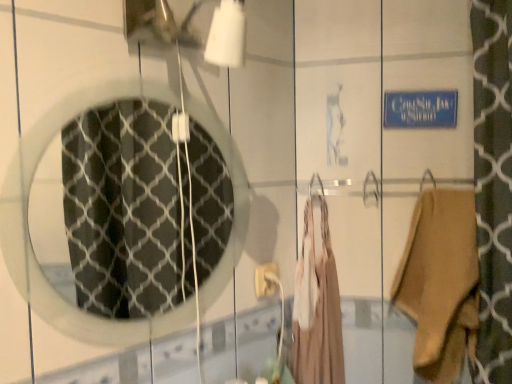
Locate an element on the screen. The height and width of the screenshot is (384, 512). tan suede boot at right, the 1th clothing viewed from the right is located at coordinates (440, 282).

From a real-world perspective, does beige fabric dress at center, which is the 2th clothing from right to left, sit lower than white plastic electric outlet at center?

Yes, from a real-world perspective, beige fabric dress at center, which is the 2th clothing from right to left, is below white plastic electric outlet at center.

Image resolution: width=512 pixels, height=384 pixels. I want to click on electric outlet behind the beige fabric dress at center, the 1th clothing when ordered from left to right, so click(x=265, y=280).

From the image's perspective, is beige fabric dress at center, which is the 2th clothing from right to left, over white plastic electric outlet at center?

Incorrect, from the image's perspective, beige fabric dress at center, which is the 2th clothing from right to left, is lower than white plastic electric outlet at center.

From a real-world perspective, who is located higher, clear glass mirror at center or tan suede boot at right, the 1th clothing viewed from the right?

clear glass mirror at center.

From the image's perspective, who appears lower, clear glass mirror at center or tan suede boot at right, the 1th clothing viewed from the right?

tan suede boot at right, the 1th clothing viewed from the right.

Are clear glass mirror at center and tan suede boot at right, the 1th clothing viewed from the right, located far from each other?

That's right, there is a large distance between clear glass mirror at center and tan suede boot at right, the 1th clothing viewed from the right.

Is point (166, 205) behind point (458, 359)?

Yes, point (166, 205) is farther from viewer.

Considering the relative sizes of white plastic electric outlet at center and clear glass mirror at center in the image provided, is white plastic electric outlet at center wider than clear glass mirror at center?

Correct, the width of white plastic electric outlet at center exceeds that of clear glass mirror at center.

Is white plastic electric outlet at center in contact with clear glass mirror at center?

No, white plastic electric outlet at center is not beside clear glass mirror at center.

Does white plastic electric outlet at center have a greater height compared to clear glass mirror at center?

No, white plastic electric outlet at center is not taller than clear glass mirror at center.

Where is `electric outlet on the right of clear glass mirror at center`? The width and height of the screenshot is (512, 384). electric outlet on the right of clear glass mirror at center is located at coordinates (265, 280).

In the scene shown: From a real-world perspective, is tan suede boot at right, the second clothing viewed from the left, positioned over white plastic electric outlet at center based on gravity?

Actually, tan suede boot at right, the second clothing viewed from the left, is physically below white plastic electric outlet at center in the real world.

Is tan suede boot at right, the 1th clothing viewed from the right, not near white plastic electric outlet at center?

No, tan suede boot at right, the 1th clothing viewed from the right, is in close proximity to white plastic electric outlet at center.

Which of these two, tan suede boot at right, the 1th clothing viewed from the right, or white plastic electric outlet at center, is wider?

tan suede boot at right, the 1th clothing viewed from the right.

Is tan suede boot at right, the 1th clothing viewed from the right, behind white plastic electric outlet at center?

No, it is in front of white plastic electric outlet at center.

Does clear glass mirror at center come in front of white plastic electric outlet at center?

Yes, it is.

Between clear glass mirror at center and white plastic electric outlet at center, which one appears on the right side from the viewer's perspective?

white plastic electric outlet at center is more to the right.

Is clear glass mirror at center situated inside white plastic electric outlet at center or outside?

clear glass mirror at center lies outside white plastic electric outlet at center.

Based on the photo, can you see clear glass mirror at center touching white plastic electric outlet at center?

No, clear glass mirror at center is not with white plastic electric outlet at center.

From the image's perspective, does beige fabric dress at center, which is the 2th clothing from right to left, appear higher than clear glass mirror at center?

Incorrect, from the image's perspective, beige fabric dress at center, which is the 2th clothing from right to left, is lower than clear glass mirror at center.

Is beige fabric dress at center, the 1th clothing when ordered from left to right, in front of or behind clear glass mirror at center in the image?

beige fabric dress at center, the 1th clothing when ordered from left to right, is behind clear glass mirror at center.

Is point (317, 285) positioned after point (217, 239)?

No, it is not.

Looking at their sizes, would you say beige fabric dress at center, which is the 2th clothing from right to left, is wider or thinner than clear glass mirror at center?

Clearly, beige fabric dress at center, which is the 2th clothing from right to left, has more width compared to clear glass mirror at center.

From a real-world perspective, between tan suede boot at right, the second clothing viewed from the left, and beige fabric dress at center, which is the 2th clothing from right to left, who is vertically higher?

In real-world perspective, tan suede boot at right, the second clothing viewed from the left, is above.

Is tan suede boot at right, the second clothing viewed from the left, inside or outside of beige fabric dress at center, the 1th clothing when ordered from left to right?

tan suede boot at right, the second clothing viewed from the left, is not enclosed by beige fabric dress at center, the 1th clothing when ordered from left to right.

In the image, there is a tan suede boot at right, the second clothing viewed from the left. Identify the location of clothing below it (from a real-world perspective). This screenshot has height=384, width=512. (319, 312).

Looking at this image, considering the relative sizes of tan suede boot at right, the second clothing viewed from the left, and beige fabric dress at center, the 1th clothing when ordered from left to right, in the image provided, is tan suede boot at right, the second clothing viewed from the left, shorter than beige fabric dress at center, the 1th clothing when ordered from left to right,?

Yes.

Where is `electric outlet above the beige fabric dress at center, which is the 2th clothing from right to left (from a real-world perspective)`? The width and height of the screenshot is (512, 384). electric outlet above the beige fabric dress at center, which is the 2th clothing from right to left (from a real-world perspective) is located at coordinates (265, 280).

In the image, there is a tan suede boot at right, the second clothing viewed from the left. Identify the location of mirror above it (from the image's perspective). (123, 209).

From the image, which object appears to be farther from clear glass mirror at center, tan suede boot at right, the 1th clothing viewed from the right, or beige fabric dress at center, the 1th clothing when ordered from left to right?

tan suede boot at right, the 1th clothing viewed from the right, lies further to clear glass mirror at center than the other object.

Estimate the real-world distances between objects in this image. Which object is further from clear glass mirror at center, beige fabric dress at center, which is the 2th clothing from right to left, or tan suede boot at right, the second clothing viewed from the left?

The object further to clear glass mirror at center is tan suede boot at right, the second clothing viewed from the left.

Considering their positions, is white plastic electric outlet at center positioned further to tan suede boot at right, the 1th clothing viewed from the right, than beige fabric dress at center, the 1th clothing when ordered from left to right?

white plastic electric outlet at center is positioned further to the anchor tan suede boot at right, the 1th clothing viewed from the right.

Based on their spatial positions, is clear glass mirror at center or white plastic electric outlet at center further from tan suede boot at right, the 1th clothing viewed from the right?

clear glass mirror at center is positioned further to the anchor tan suede boot at right, the 1th clothing viewed from the right.

When comparing their distances from white plastic electric outlet at center, does tan suede boot at right, the second clothing viewed from the left, or clear glass mirror at center seem closer?

The object closer to white plastic electric outlet at center is tan suede boot at right, the second clothing viewed from the left.

Consider the image. Based on their spatial positions, is clear glass mirror at center or white plastic electric outlet at center closer to beige fabric dress at center, the 1th clothing when ordered from left to right?

white plastic electric outlet at center.

Based on their spatial positions, is clear glass mirror at center or beige fabric dress at center, which is the 2th clothing from right to left, closer to white plastic electric outlet at center?

The object closer to white plastic electric outlet at center is beige fabric dress at center, which is the 2th clothing from right to left.

Which object lies further to the anchor point beige fabric dress at center, which is the 2th clothing from right to left, white plastic electric outlet at center or clear glass mirror at center?

clear glass mirror at center is positioned further to the anchor beige fabric dress at center, which is the 2th clothing from right to left.

The height and width of the screenshot is (384, 512). In order to click on clothing between white plastic electric outlet at center and tan suede boot at right, the 1th clothing viewed from the right in this screenshot , I will do `click(319, 312)`.

The height and width of the screenshot is (384, 512). What are the coordinates of `electric outlet located between clear glass mirror at center and tan suede boot at right, the 1th clothing viewed from the right, in the left-right direction` in the screenshot? It's located at (265, 280).

Identify the location of clothing situated between clear glass mirror at center and tan suede boot at right, the second clothing viewed from the left, from left to right. (319, 312).